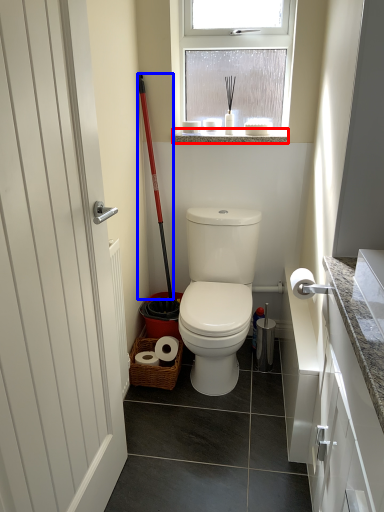
Question: Which point is closer to the camera, window sill (highlighted by a red box) or shovel (highlighted by a blue box)?

Choices:
 (A) window sill
 (B) shovel

Answer: (B)